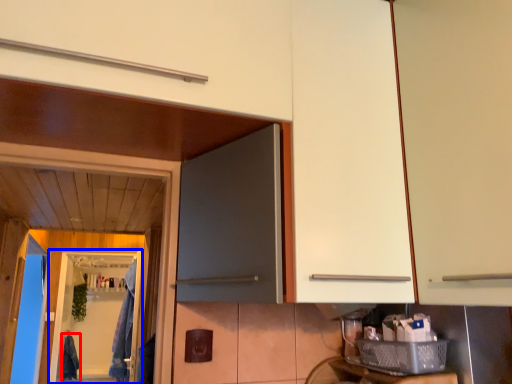
Question: Which object appears closest to the camera in this image, laundry (highlighted by a red box) or screen door (highlighted by a blue box)?

Choices:
 (A) laundry
 (B) screen door

Answer: (B)